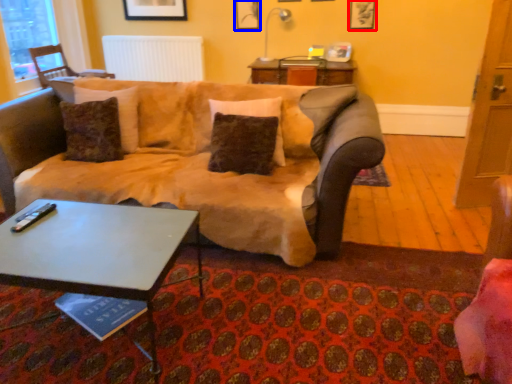
Question: Which object is closer to the camera taking this photo, picture frame (highlighted by a red box) or picture frame (highlighted by a blue box)?

Choices:
 (A) picture frame
 (B) picture frame

Answer: (A)